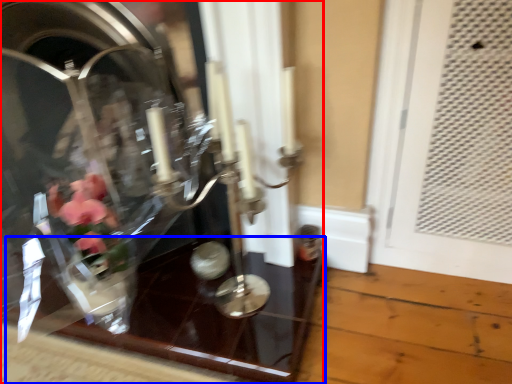
Question: Which of the following is the closest to the observer, glass box (highlighted by a red box) or glass table (highlighted by a blue box)?

Choices:
 (A) glass box
 (B) glass table

Answer: (A)